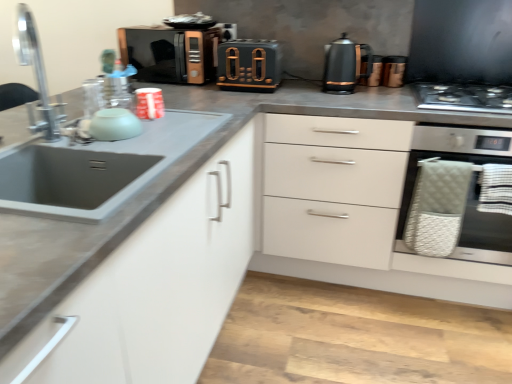
Find the location of a particular element. This screenshot has height=384, width=512. vacant space in front of copper metallic toaster at center, arranged as the 5th appliance when viewed from the front is located at coordinates (384, 88).